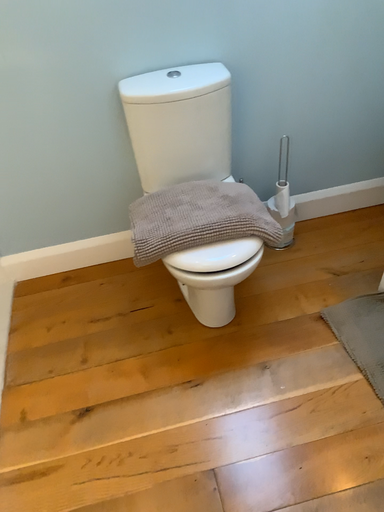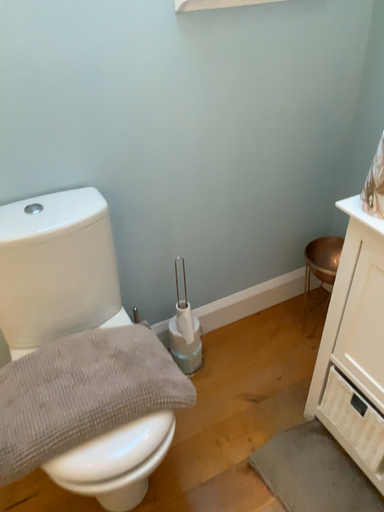
Question: How did the camera likely rotate when shooting the video?

Choices:
 (A) rotated left
 (B) rotated right

Answer: (B)